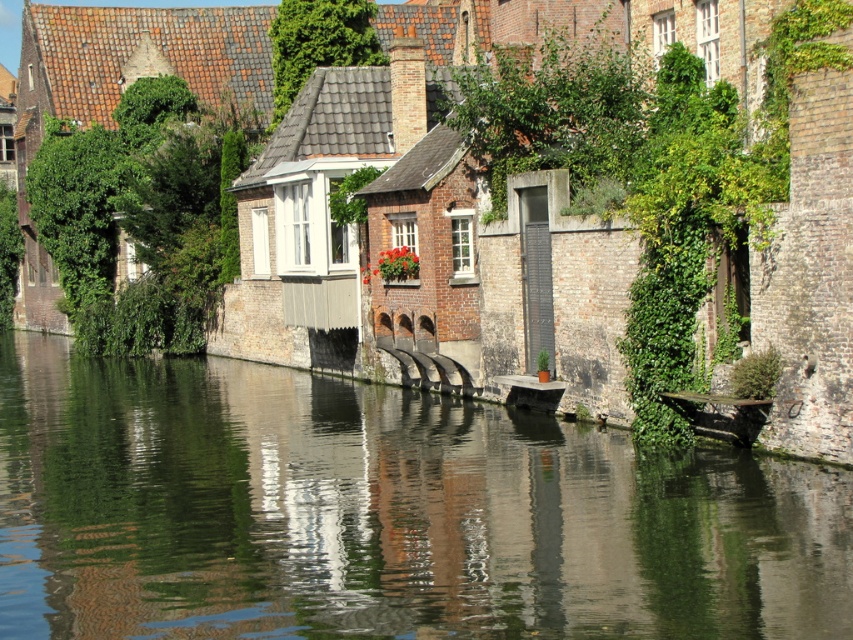
You are a tourist standing on the canal bridge and want to take a photo of the smooth concrete water at center and the wooden boat at center. Which object should you focus on first if you want to capture both in a single frame without moving the camera?

The smooth concrete water at center is bigger than the wooden boat at center, so you should focus on the smooth concrete water at center first to ensure it fills the frame appropriately before adjusting for the smaller wooden boat at center.

You are a tourist standing on the canal bank and want to take a photo of both the smooth concrete water at center and the wooden boat at center. Which object should you position to your left side in the camera frame?

You should position the smooth concrete water at center to your left side in the camera frame because it is located to the left of the wooden boat at center according to the description.